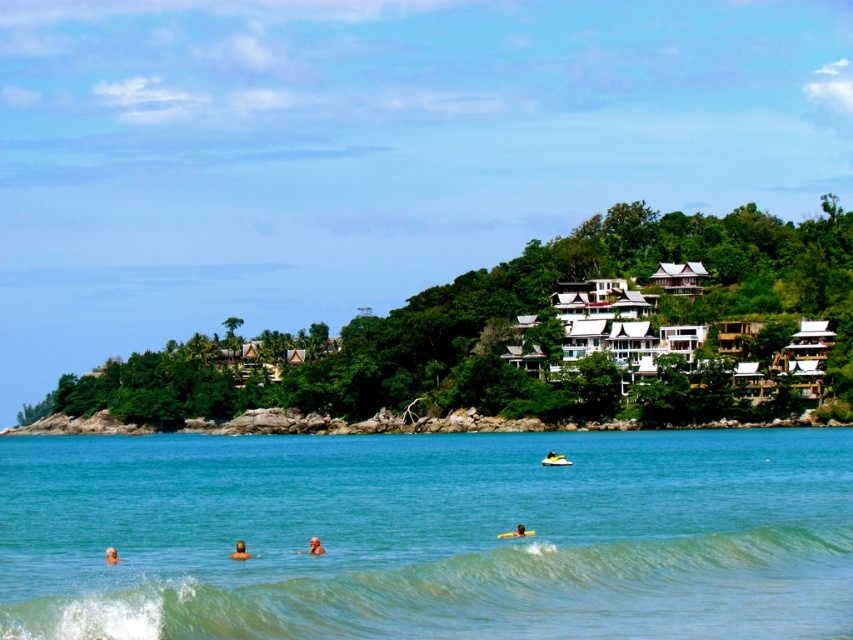
Question: Can you confirm if clear blue water at center is positioned below brown textured surfboard at center?

Choices:
 (A) yes
 (B) no

Answer: (A)

Question: Does brown skin at center appear on the left side of skinny man at center?

Choices:
 (A) yes
 (B) no

Answer: (A)

Question: Which is nearer to the skinny man at center?

Choices:
 (A) brown skin at center
 (B) brown skin at lower center

Answer: (A)

Question: Which is nearer to the skinny man at center?

Choices:
 (A) brown textured surfboard at center
 (B) yellow foam surfboard at lower center
 (C) clear blue water at center
 (D) green leafy hill at upper center

Answer: (A)

Question: Estimate the real-world distances between objects in this image. Which object is closer to the clear blue water at center?

Choices:
 (A) skinny man at center
 (B) yellow rubber surfboard at center

Answer: (B)

Question: Is clear blue water at center smaller than green leafy hill at upper center?

Choices:
 (A) no
 (B) yes

Answer: (B)